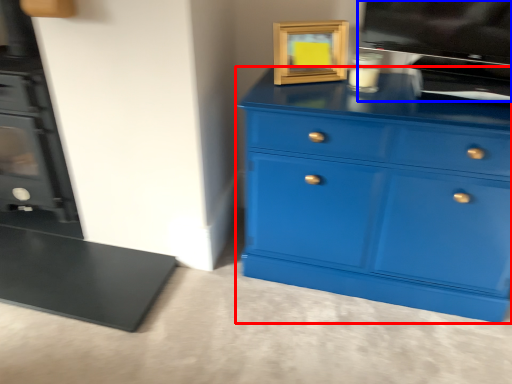
Question: Which point is closer to the camera, chest of drawers (highlighted by a red box) or appliance (highlighted by a blue box)?

Choices:
 (A) chest of drawers
 (B) appliance

Answer: (A)